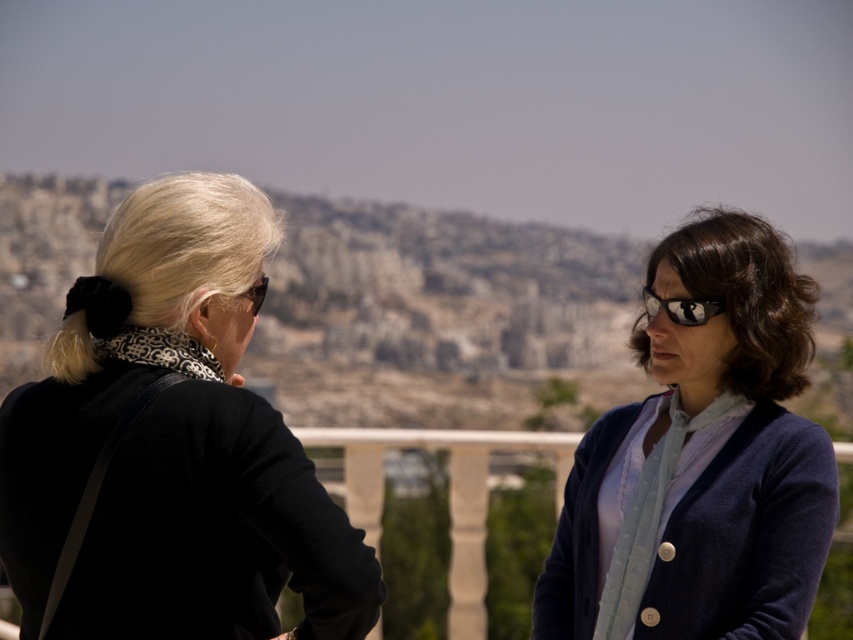
Question: Can you confirm if black matte jacket at upper left is positioned to the left of matte black goggles at upper left?

Choices:
 (A) yes
 (B) no

Answer: (A)

Question: Which point is farther from the camera taking this photo?

Choices:
 (A) (107, 333)
 (B) (683, 300)
 (C) (257, 300)
 (D) (741, 404)

Answer: (B)

Question: Is black matte jacket at upper left smaller than blue cardigan at right?

Choices:
 (A) yes
 (B) no

Answer: (A)

Question: Where is blue cardigan at right located in relation to matte black goggles at upper left in the image?

Choices:
 (A) above
 (B) below

Answer: (B)

Question: Considering the real-world distances, which object is closest to the matte black goggles at upper left?

Choices:
 (A) matte black goggles at right
 (B) black matte jacket at upper left

Answer: (B)

Question: Which of the following is the farthest from the observer?

Choices:
 (A) (680, 310)
 (B) (241, 298)
 (C) (202, 308)

Answer: (A)